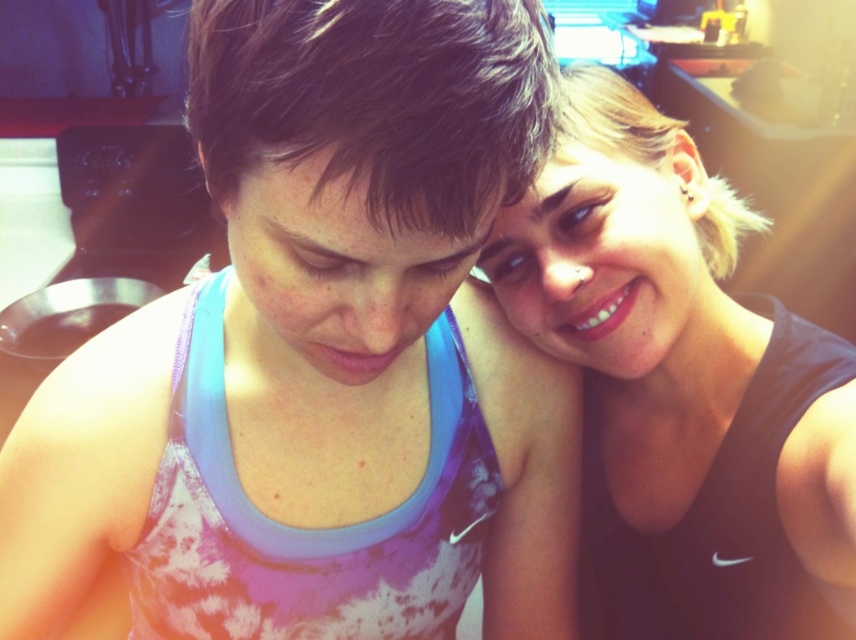
Question: Does matte blue tank top at upper right appear over matte black tank top at upper right?

Choices:
 (A) no
 (B) yes

Answer: (A)

Question: Among these objects, which one is nearest to the camera?

Choices:
 (A) matte black tank top at upper right
 (B) matte blue tank top at upper right

Answer: (B)

Question: Observing the image, what is the correct spatial positioning of matte blue tank top at upper right in reference to matte black tank top at upper right?

Choices:
 (A) left
 (B) right

Answer: (A)

Question: Considering the relative positions of matte blue tank top at upper right and matte black tank top at upper right in the image provided, where is matte blue tank top at upper right located with respect to matte black tank top at upper right?

Choices:
 (A) right
 (B) left

Answer: (B)

Question: Which point is closer to the camera?

Choices:
 (A) (437, 109)
 (B) (504, 220)

Answer: (A)